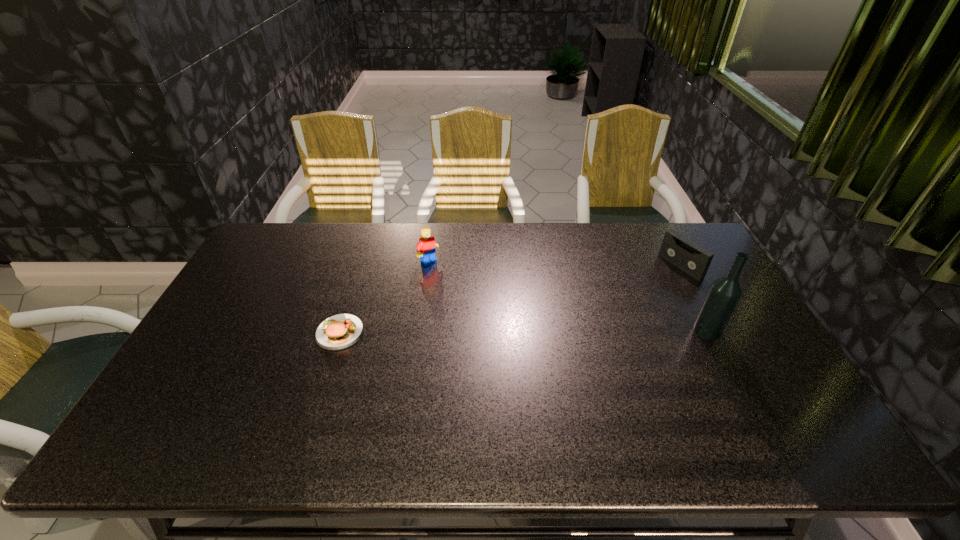
Identify the location of vacant space on the desktop that is between the leftmost object and the tallest object and is positioned on the front-facing side of the third tallest object. (561, 332).

Where is `free space on the desktop that is between the shortest object and the tallest object and is positioned on the face of the third shortest object`? The image size is (960, 540). free space on the desktop that is between the shortest object and the tallest object and is positioned on the face of the third shortest object is located at coordinates (x=530, y=332).